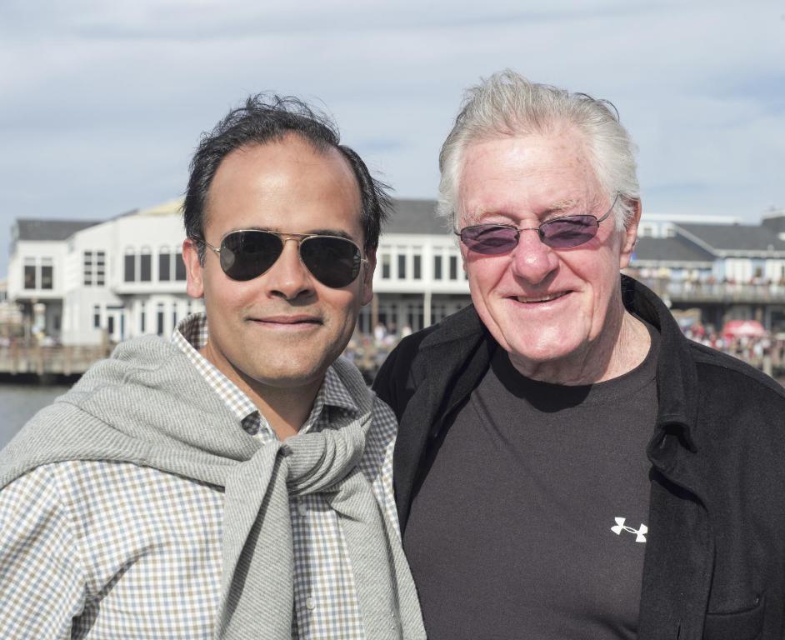
You are a photographer setting up a shot of the two people in the scene. You need to ensure that both the black matte jacket at center and the gray wool scarf at left are fully visible in the frame. Given that your camera has a fixed width, which object should you prioritize keeping centered to avoid cropping?

The black matte jacket at center might be wider than gray wool scarf at left, so prioritizing the black matte jacket at center in the center will ensure it fits within the frame without cropping.

You are a photographer trying to capture both the black matte jacket at center and the matte black sunglasses at center in a single frame. Given their sizes, which object will occupy more space in your photo?

The black matte jacket at center is bigger than the matte black sunglasses at center, so it will occupy more space in the photo.